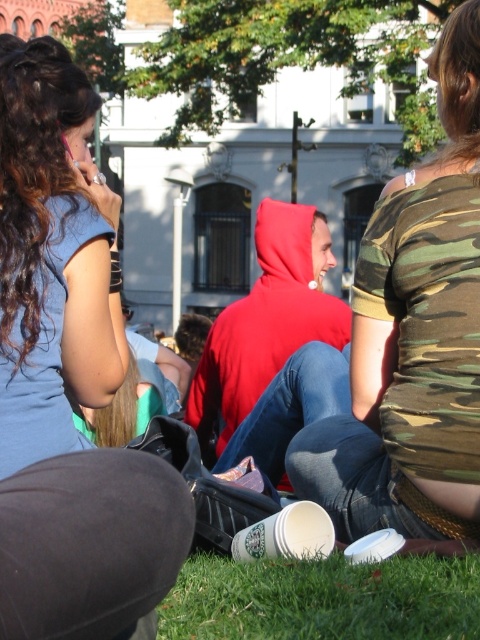
You are standing in the park scene and want to place a small picnic basket between the camouflage fabric shirt at center and the green grass at lower center. Which object should you place the basket closer to to ensure it is visible from your current position?

You should place the picnic basket closer to the camouflage fabric shirt at center because it is closer to you than the green grass at lower center, making it more visible from your current position.

You are designing a layout for a magazine spread and need to place a photo of the matte blue shirt at upper left next to an image of the green grass at lower center. Which object should you make smaller in the layout to maintain visual balance?

The matte blue shirt at upper left has a lesser width compared to the green grass at lower center, so to maintain visual balance, you should make the matte blue shirt at upper left smaller in the layout.